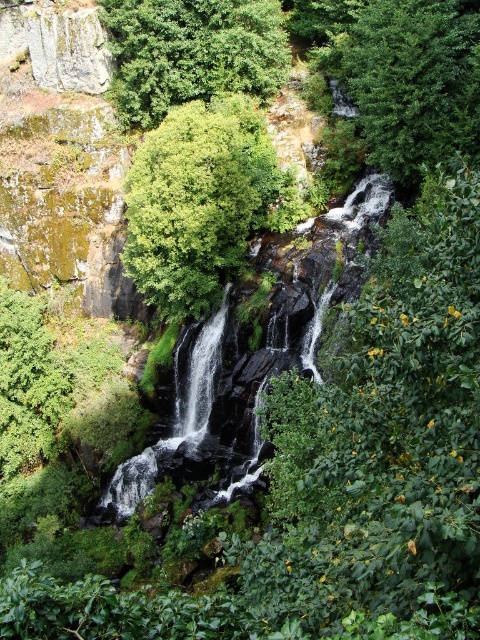
Question: Among these objects, which one is farthest from the camera?

Choices:
 (A) green leafy tree at center
 (B) green leafy tree at upper right

Answer: (A)

Question: Can you confirm if green leafy tree at center is positioned to the right of green leafy tree at upper right?

Choices:
 (A) yes
 (B) no

Answer: (B)

Question: Is green leafy tree at upper center positioned behind green mossy waterfall at center?

Choices:
 (A) no
 (B) yes

Answer: (B)

Question: Which of these objects is positioned farthest from the green leafy tree at upper center?

Choices:
 (A) green mossy waterfall at center
 (B) green leafy tree at center

Answer: (A)

Question: Can you confirm if green leafy tree at center is positioned to the right of smooth rock waterfall at center?

Choices:
 (A) yes
 (B) no

Answer: (B)

Question: Which is farther from the green leafy tree at upper center?

Choices:
 (A) green leafy tree at center
 (B) smooth rock waterfall at center
 (C) green leafy tree at upper right

Answer: (B)